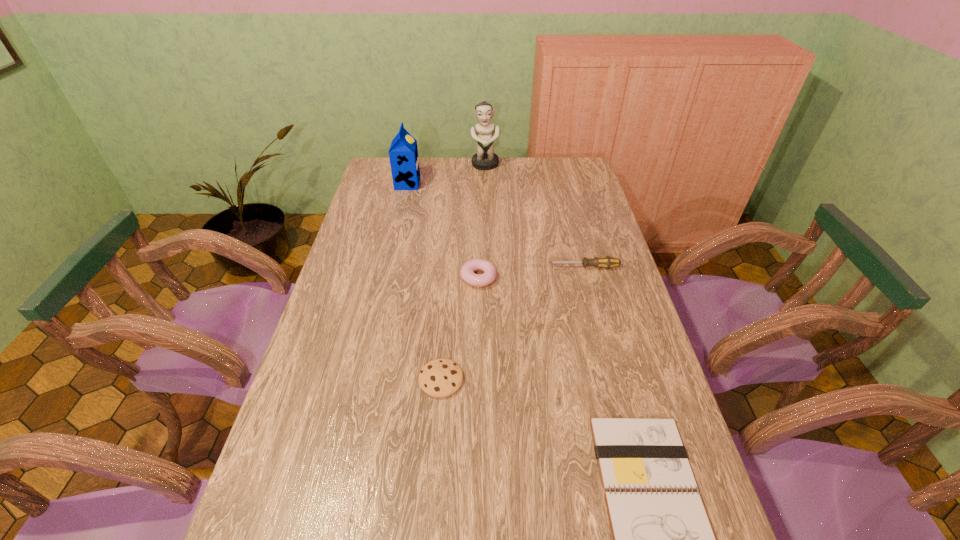
In order to click on vacant point at the right edge in this screenshot , I will do `click(574, 276)`.

In the image, there is a desktop. Where is `vacant space at the far right corner`? This screenshot has height=540, width=960. vacant space at the far right corner is located at coordinates (575, 184).

Where is `free space between the farthest object and the doughnut`? Image resolution: width=960 pixels, height=540 pixels. free space between the farthest object and the doughnut is located at coordinates (482, 221).

Where is `unoccupied position between the fifth nearest object and the figurine`? This screenshot has height=540, width=960. unoccupied position between the fifth nearest object and the figurine is located at coordinates (446, 174).

The image size is (960, 540). What are the coordinates of `vacant area that lies between the doughnut and the screwdriver` in the screenshot? It's located at (531, 273).

Find the location of a particular element. unoccupied position between the carton and the screwdriver is located at coordinates (495, 226).

This screenshot has width=960, height=540. Find the location of `free space between the screwdriver and the doughnut`. free space between the screwdriver and the doughnut is located at coordinates (531, 273).

Identify the location of empty space between the figurine and the doughnut. The width and height of the screenshot is (960, 540). (482, 221).

Identify which object is the second closest to the shortest object. Please provide its 2D coordinates. Your answer should be formatted as a tuple, i.e. [(x, y)], where the tuple contains the x and y coordinates of a point satisfying the conditions above.

[(467, 271)]

Where is `object that is the closest to the cookie`? The height and width of the screenshot is (540, 960). object that is the closest to the cookie is located at coordinates (467, 271).